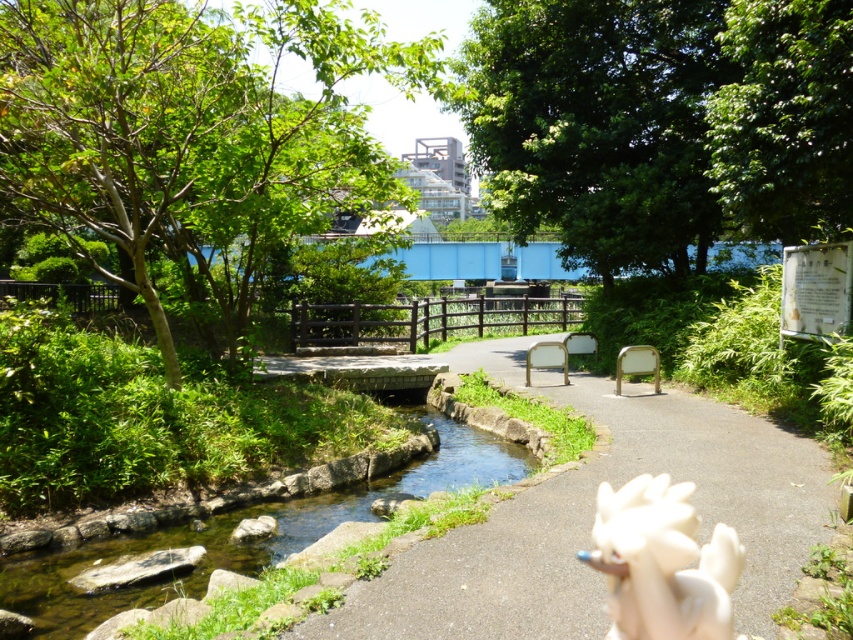
You are a person standing at the entrance of the park and want to cross to the wooden bridge ahead. You see the smooth stone path at center and the green stone stream at center. Which one is closer to you?

The smooth stone path at center is closer to the viewer than the green stone stream at center, so the smooth stone path at center is closer to you.

You are a gardener who needs to place a new decorative item in the park. You have the green stone stream at center and the white matte gloves at lower right. Which object takes up more space in the image?

The white matte gloves at lower right takes up more space in the image since the green stone stream at center has a smaller size compared to white matte gloves at lower right.

You are a gardener holding a pair of shears and standing near the white matte gloves at lower right. You need to trim the shrubs along the smooth stone path at center. Which direction should you move to reach the path first?

You should move towards the smooth stone path at center because it is closer to you than the white matte gloves at lower right, so you can reach it without moving away from your current position.